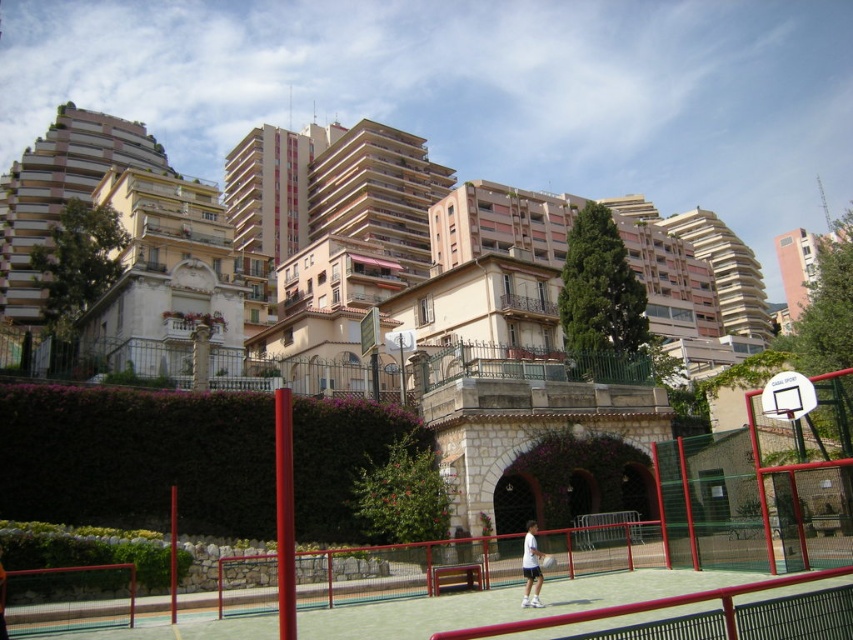
Based on the photo, between white cotton shirt at center and white rubber tennis racket at center, which one has more height?

white cotton shirt at center is taller.

Measure the distance between white cotton shirt at center and camera.

white cotton shirt at center is 36.44 meters away from camera.

The height and width of the screenshot is (640, 853). Identify the location of white cotton shirt at center. (531, 566).